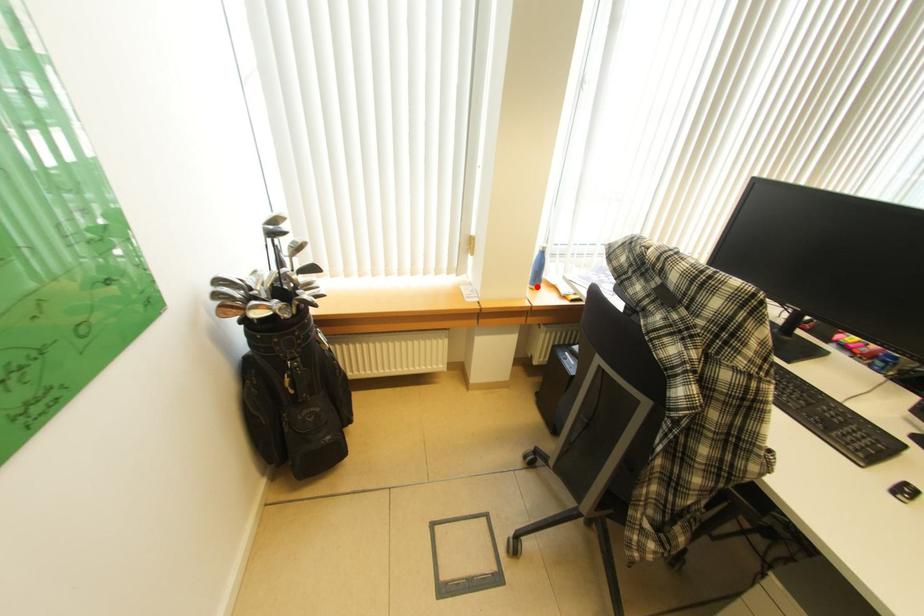
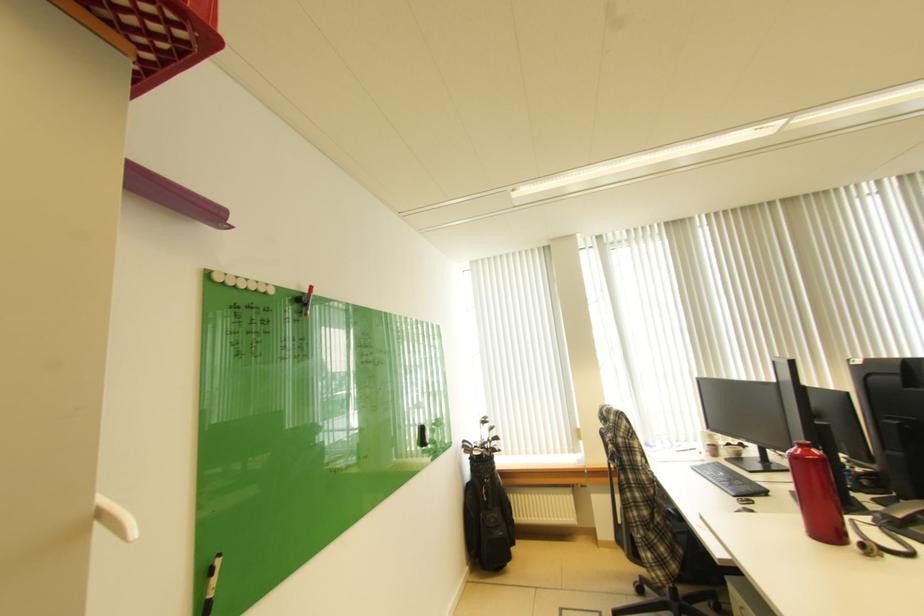
Question: I am providing you with two images of the same scene from different viewpoints. A red point is marked on the first image. Is the red point's position out of view in image 2?

Choices:
 (A) Yes
 (B) No

Answer: (A)